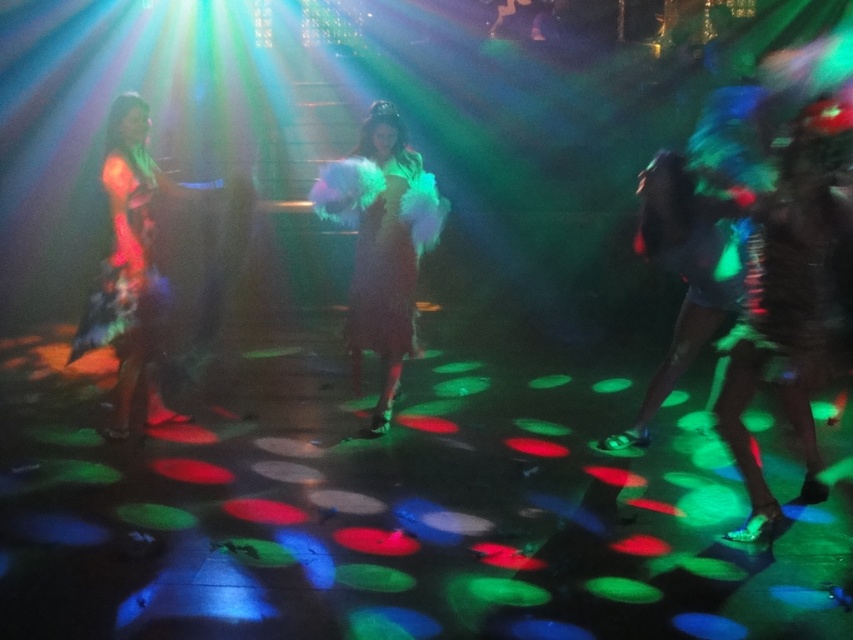
Does fuzzy black dress at right have a greater width compared to fuzzy multicolored boa at center?

Incorrect, fuzzy black dress at right's width does not surpass fuzzy multicolored boa at center's.

Is fuzzy black dress at right further to camera compared to fuzzy multicolored boa at center?

No.

In order to click on fuzzy black dress at right in this screenshot , I will do `click(791, 288)`.

Which is more to the left, shiny metallic dress at left or shiny metallic dress at right?

shiny metallic dress at left

Between shiny metallic dress at left and shiny metallic dress at right, which one appears on the right side from the viewer's perspective?

Positioned to the right is shiny metallic dress at right.

I want to click on shiny metallic dress at left, so click(132, 272).

Is fuzzy multicolored boa at center to the right of shiny metallic dress at right from the viewer's perspective?

In fact, fuzzy multicolored boa at center is to the left of shiny metallic dress at right.

Is point (440, 227) more distant than point (679, 339)?

Yes, it is behind point (679, 339).

Locate an element on the screen. This screenshot has width=853, height=640. fuzzy multicolored boa at center is located at coordinates (381, 243).